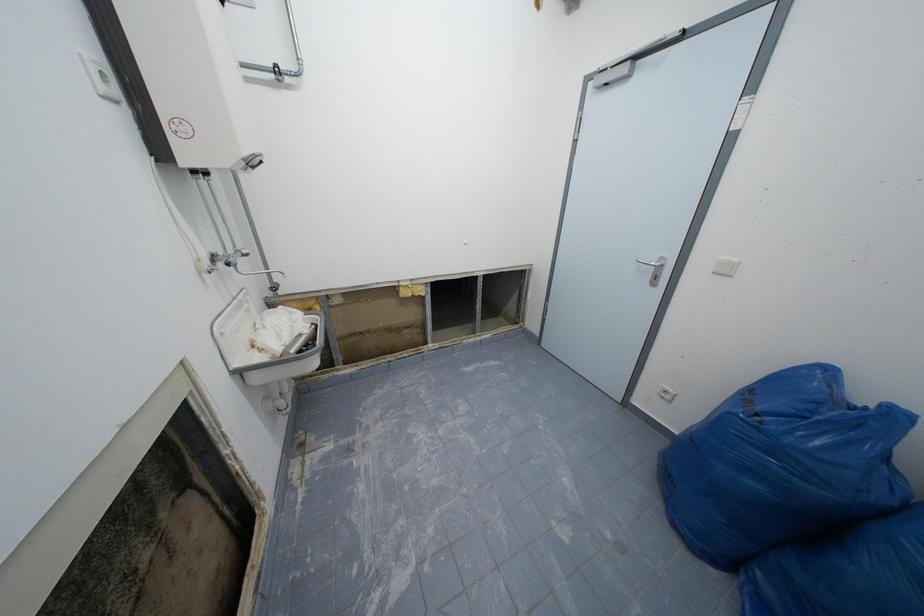
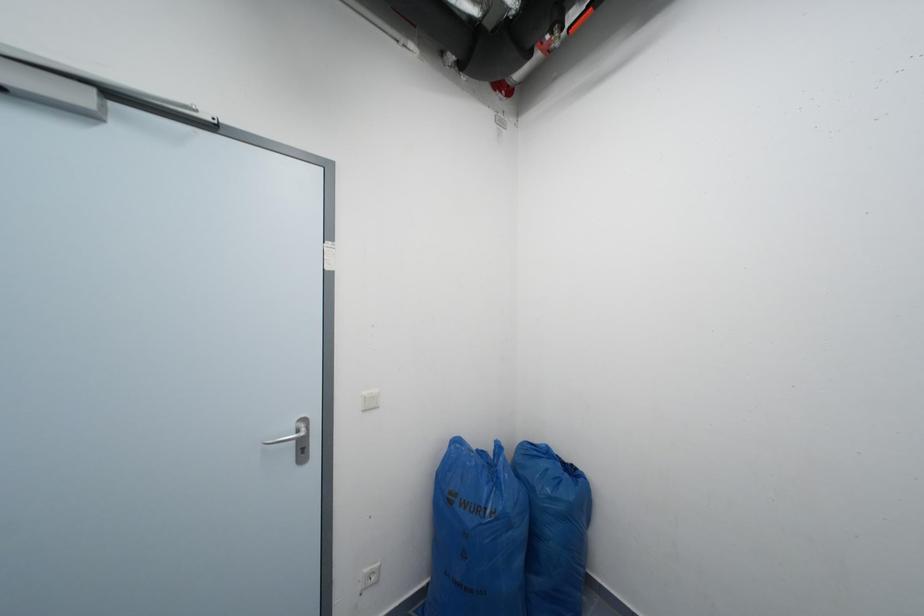
Question: How did the camera likely rotate?

Choices:
 (A) Left
 (B) Right
 (C) Up
 (D) Down

Answer: (B)